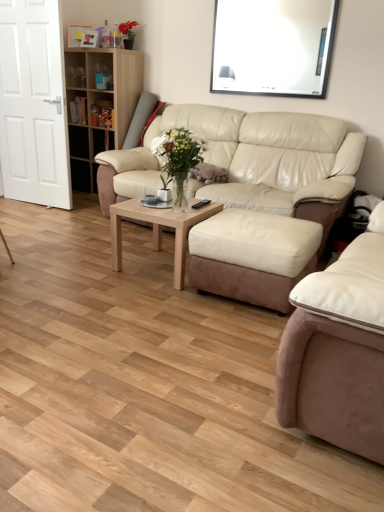
At what (x,y) coordinates should I click in order to perform the action: click on vacant space in front of white leather ottoman at center. Please return your answer as a coordinate pair (x, y). Looking at the image, I should click on tap(227, 330).